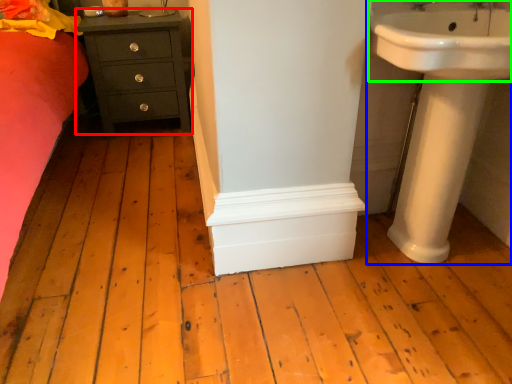
Question: Which object is the farthest from chest of drawers (highlighted by a red box)? Choose among these: sink (highlighted by a blue box) or sink (highlighted by a green box).

Choices:
 (A) sink
 (B) sink

Answer: (B)